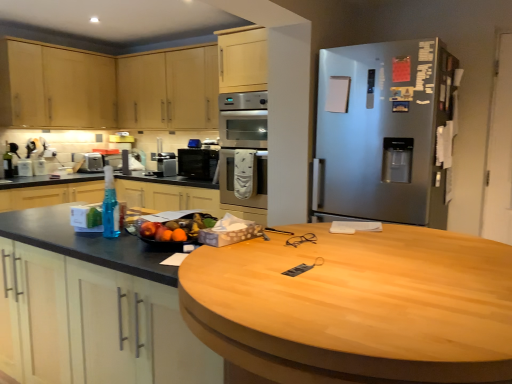
Question: In terms of width, does satin silver refrigerator at right look wider or thinner when compared to satin silver toaster at left, positioned as the 2th appliance in front-to-back order?

Choices:
 (A) wide
 (B) thin

Answer: (A)

Question: Considering the positions of satin silver refrigerator at right and satin silver toaster at left, positioned as the second appliance in right-to-left order, in the image, is satin silver refrigerator at right taller or shorter than satin silver toaster at left, positioned as the second appliance in right-to-left order,?

Choices:
 (A) short
 (B) tall

Answer: (B)

Question: Based on their relative distances, which object is nearer to the shiny plastic bowl of mixed fruits at center?

Choices:
 (A) satin black coffee maker at center, acting as the first appliance starting from the right
 (B) satin silver toaster at left, the 1th appliance from the left
 (C) blue translucent spray bottle at left, the first bottle in the right-to-left sequence
 (D) light wood cabinet at upper left, which is the 2th cabinetry in left-to-right order
 (E) satin silver refrigerator at right

Answer: (E)

Question: Considering the real-world distances, which object is farthest from the blue translucent spray bottle at left, marked as the first bottle in a bottom-to-top arrangement?

Choices:
 (A) shiny plastic bowl of mixed fruits at center
 (B) satin black coffee maker at center, marked as the 2th appliance in a left-to-right arrangement
 (C) black glass microwave at center
 (D) light wood cabinet at upper left, which appears as the first cabinetry when viewed from the left
 (E) satin silver refrigerator at right

Answer: (E)